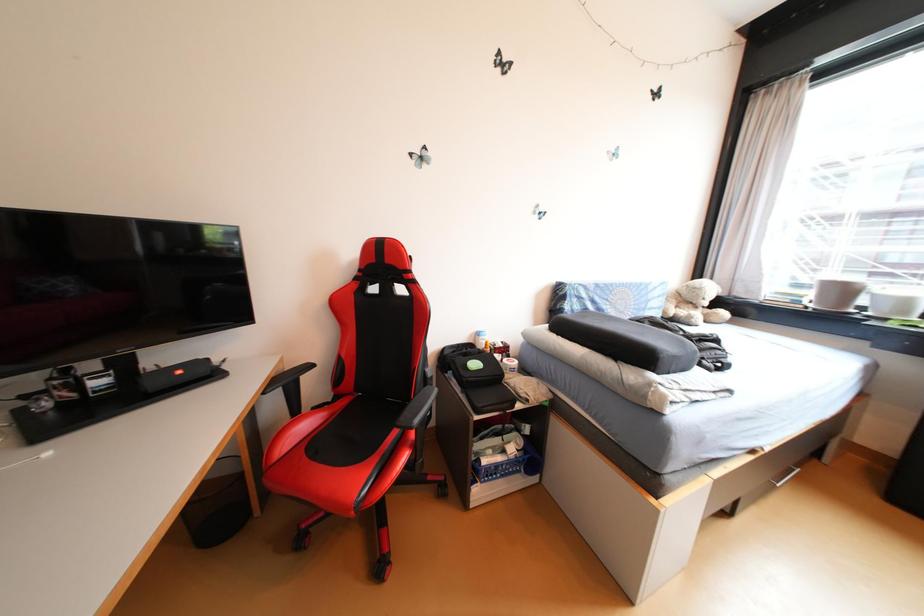
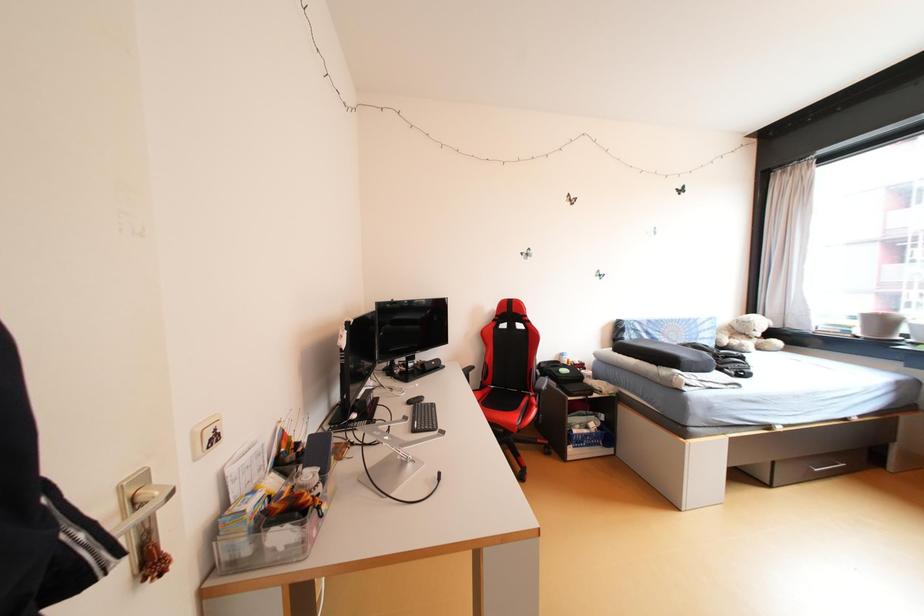
Question: Which direction would the cameraman need to move to produce the second image? Reply with the corresponding letter.

Choices:
 (A) Left
 (B) Right
 (C) Forward
 (D) Backward

Answer: (D)